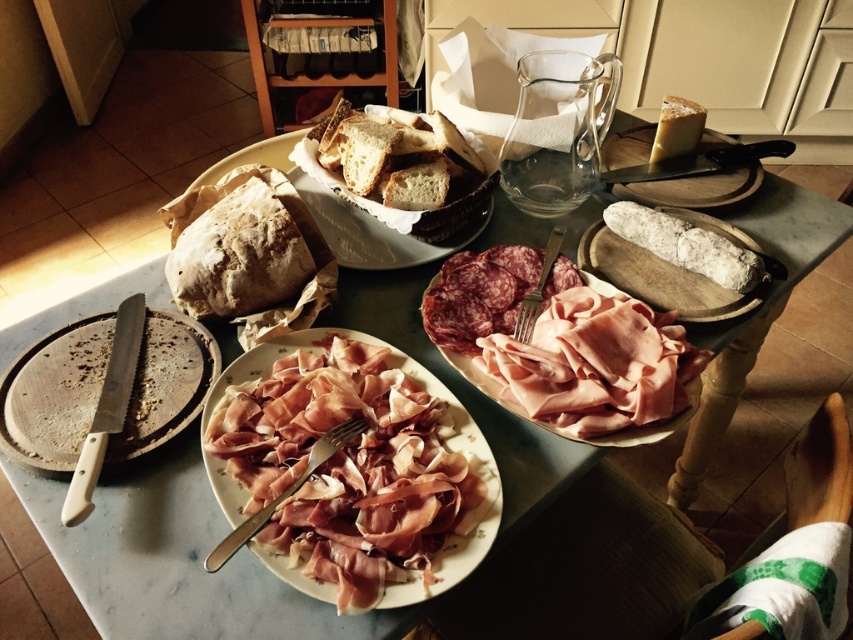
You are standing at the edge of the table and want to reach both points mentioned. Which point, point (113,460) or point (637,428), is closer to you?

Point (113,460) is closer to you because it is in front of point (637,428).